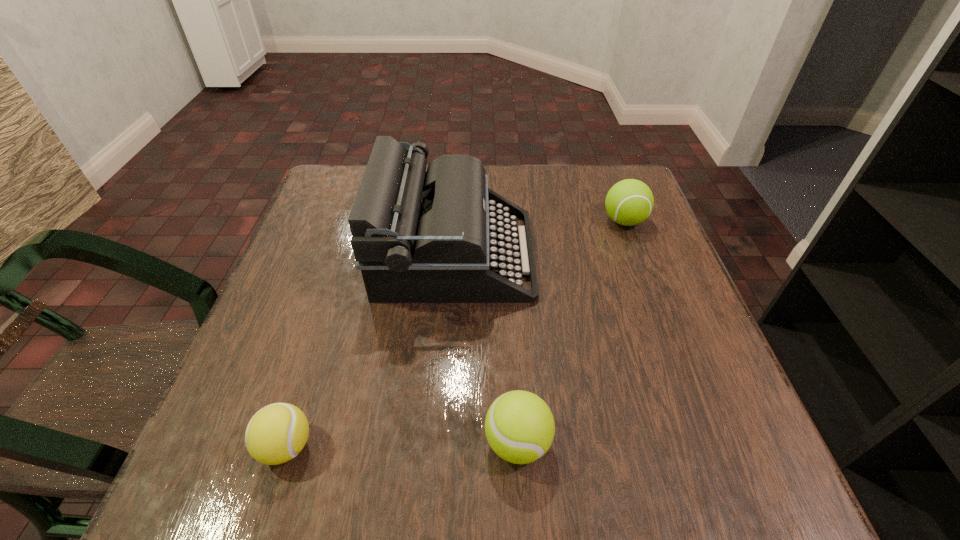
Identify the location of typewriter that is at the far edge. The width and height of the screenshot is (960, 540). pos(438,236).

The image size is (960, 540). What are the coordinates of `tennis ball present at the far edge` in the screenshot? It's located at (629, 202).

Image resolution: width=960 pixels, height=540 pixels. In order to click on object that is at the left edge in this screenshot , I will do `click(277, 433)`.

Locate an element on the screen. The image size is (960, 540). object that is positioned at the right edge is located at coordinates (629, 202).

Where is `object that is at the near left corner`? This screenshot has height=540, width=960. object that is at the near left corner is located at coordinates (277, 433).

Find the location of a particular element. object that is at the far right corner is located at coordinates (629, 202).

You are a GUI agent. You are given a task and a screenshot of the screen. Output one action in this format:
    pyautogui.click(x=<x>, y=<y>)
    Task: Click on the vacant position at the far edge of the desktop
    The image size is (960, 540).
    Given the screenshot: What is the action you would take?
    [x=487, y=168]

At what (x,y) coordinates should I click in order to perform the action: click on vacant space at the near edge of the desktop. Please return your answer as a coordinate pair (x, y). The height and width of the screenshot is (540, 960). Looking at the image, I should click on (596, 473).

Locate an element on the screen. The height and width of the screenshot is (540, 960). blank space at the left edge of the desktop is located at coordinates (346, 246).

The height and width of the screenshot is (540, 960). I want to click on free space at the right edge of the desktop, so click(x=641, y=236).